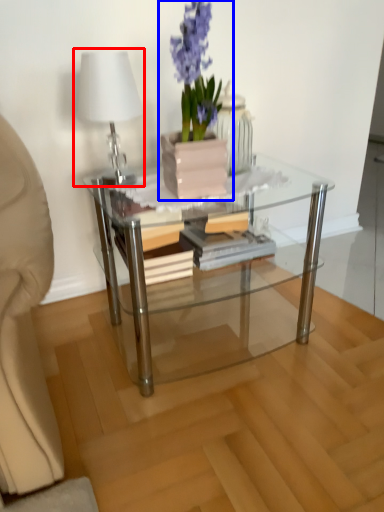
Question: Which object is closer to the camera taking this photo, table lamp (highlighted by a red box) or houseplant (highlighted by a blue box)?

Choices:
 (A) table lamp
 (B) houseplant

Answer: (B)